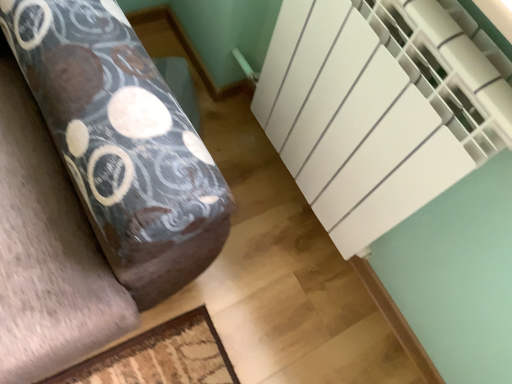
You are a GUI agent. You are given a task and a screenshot of the screen. Output one action in this format:
    pyautogui.click(x=<x>, y=<y>)
    Task: Click on the vacant area situated below white matte radiator at right (from a real-world perspective)
    Image resolution: width=512 pixels, height=384 pixels.
    Given the screenshot: What is the action you would take?
    pyautogui.click(x=268, y=183)